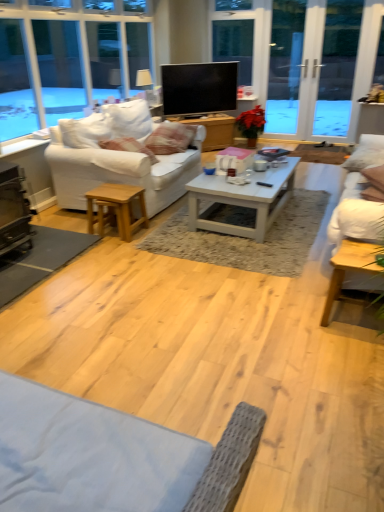
Find the location of `vacant space to the left of light brown wooden coffee table at center, which ranks as the 1th coffee table in front-to-back order`. vacant space to the left of light brown wooden coffee table at center, which ranks as the 1th coffee table in front-to-back order is located at coordinates (299, 320).